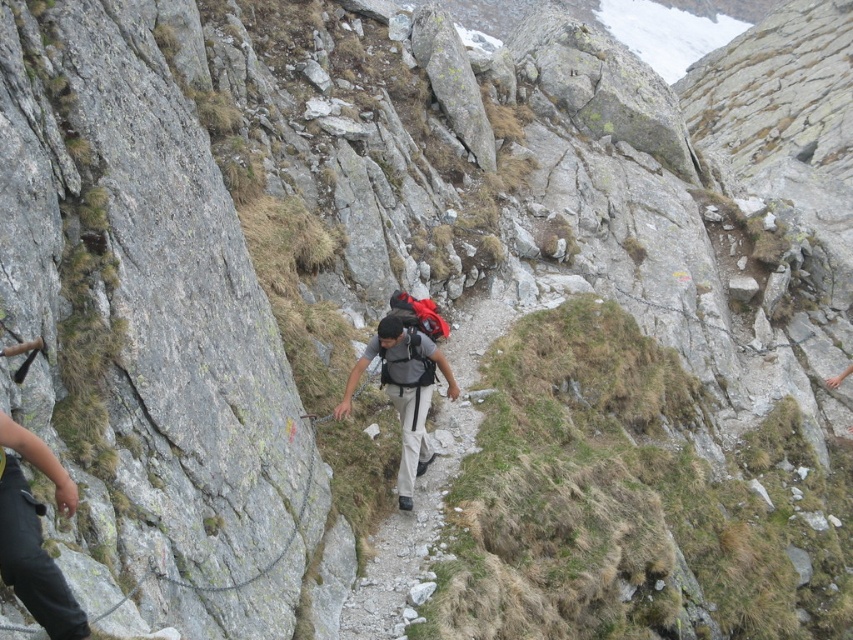
Between green grassy slope at center and matte gray backpack at center, which one has less height?

Standing shorter between the two is matte gray backpack at center.

Which is in front, point (589, 458) or point (393, 323)?

Point (393, 323) is in front.

The width and height of the screenshot is (853, 640). Find the location of `green grassy slope at center`. green grassy slope at center is located at coordinates (625, 499).